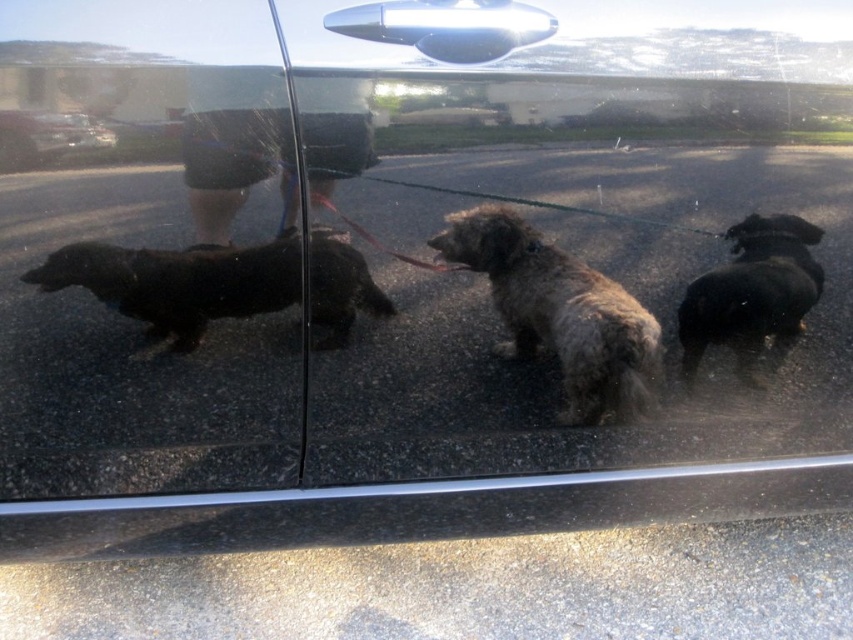
You are looking through the car window and see two points marked on the pavement outside. The points are labeled as point (283,305) and point (784,339). Which point is closer to you?

Point (283,305) is closer to the viewer than point (784,339).

You are a delivery person who needs to place a package on the pavement between the fuzzy brown dog at center and the glossy black car at upper left. Based on their sizes, which one do you think you can place the package closer to without worrying about blocking their view?

The glossy black car at upper left is shorter than the fuzzy brown dog at center, so placing the package closer to the glossy black car at upper left would be better to avoid blocking their view.

You are a passenger in the car looking at the reflection on the window. You see the fuzzy brown dog at center and the black shaggy dog at left. Which dog is positioned lower in the reflection?

The fuzzy brown dog at center is positioned lower than the black shaggy dog at left in the reflection.